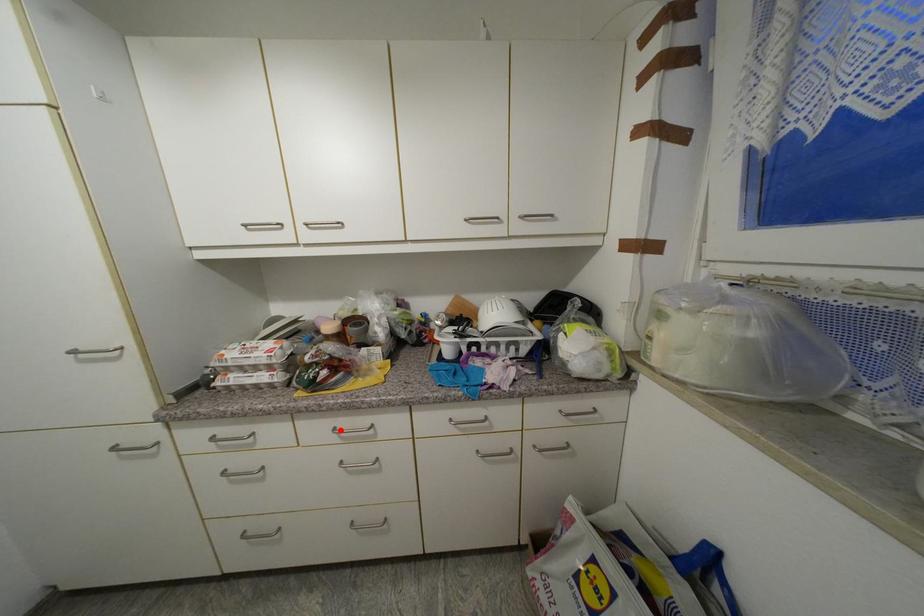
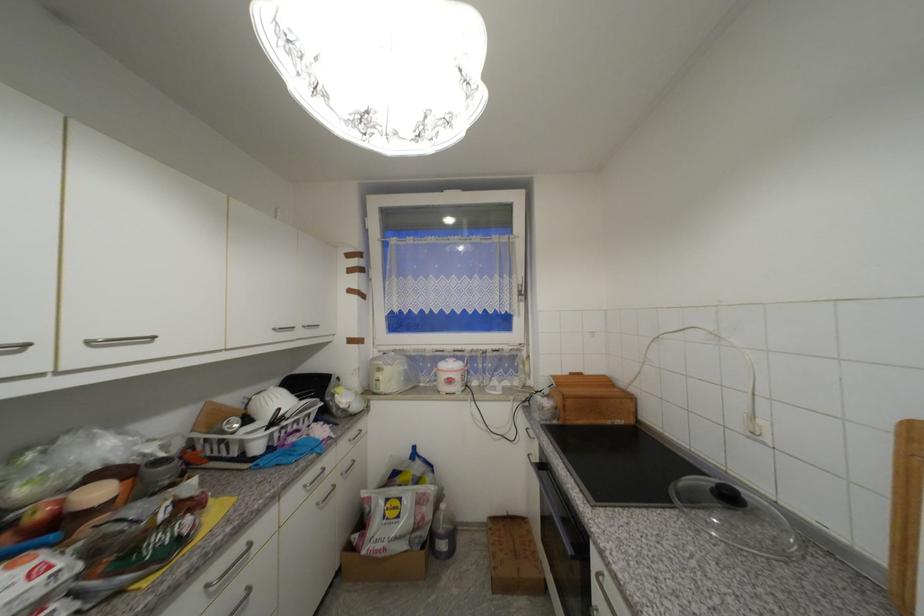
Locate, in the second image, the point that corresponds to the highlighted location in the first image.

(213, 588)